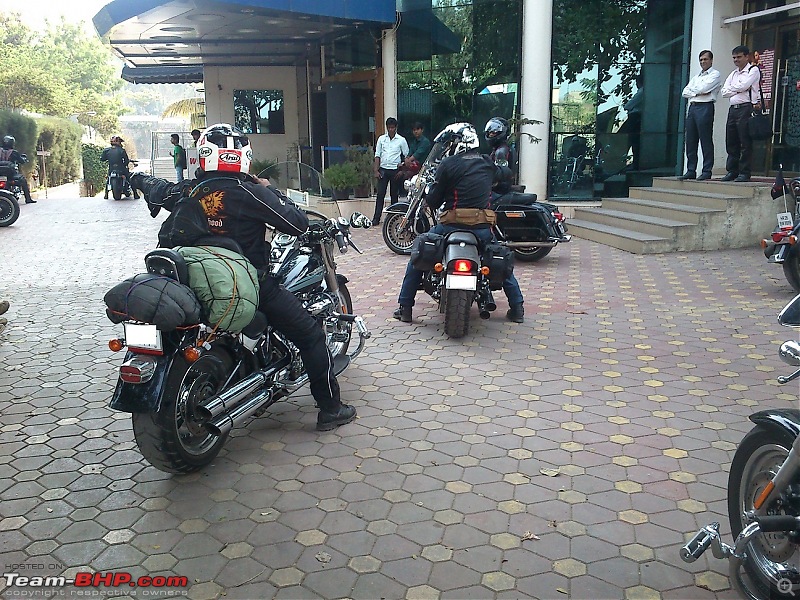
Find the location of a particular element. floor is located at coordinates 552,460.